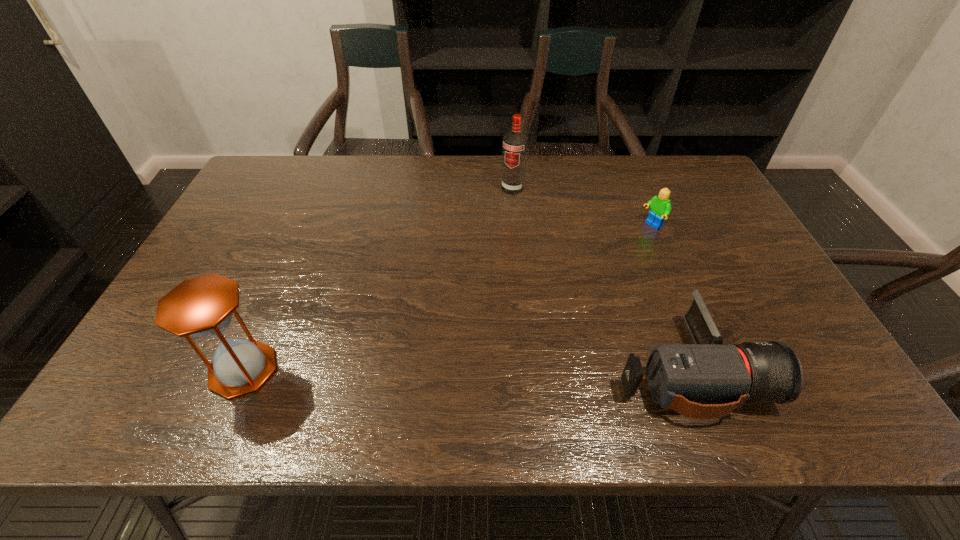
The width and height of the screenshot is (960, 540). In order to click on vacant space located on the front label of the second object from left to right in this screenshot , I will do `click(474, 264)`.

The width and height of the screenshot is (960, 540). What are the coordinates of `free space located 0.190m on the front label of the second object from left to right` in the screenshot? It's located at click(491, 232).

Where is `free region located on the front label of the second object from left to right`? free region located on the front label of the second object from left to right is located at coordinates (x=485, y=243).

Where is `object positioned at the far edge`? object positioned at the far edge is located at coordinates (515, 143).

Where is `hourglass located at the near edge`? The image size is (960, 540). hourglass located at the near edge is located at coordinates (202, 307).

In order to click on camcorder at the near edge in this screenshot , I will do tap(705, 380).

Find the location of `object that is at the right edge`. object that is at the right edge is located at coordinates (705, 380).

Where is `object at the near right corner`? The width and height of the screenshot is (960, 540). object at the near right corner is located at coordinates (705, 380).

I want to click on vacant region at the far edge of the desktop, so click(398, 164).

The image size is (960, 540). Identify the location of free region at the near edge. (326, 349).